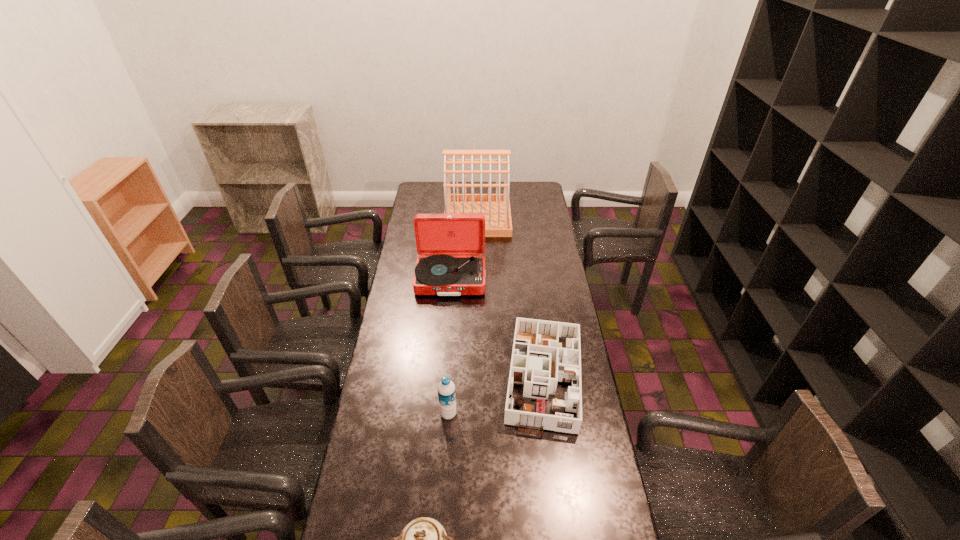
The width and height of the screenshot is (960, 540). I want to click on the tallest object, so click(495, 207).

Find the location of `birdcage`. birdcage is located at coordinates (495, 207).

Find the location of a particular element. The image size is (960, 540). the second farthest object is located at coordinates (451, 246).

Locate an element on the screen. phonograph_record is located at coordinates (451, 246).

Where is `water bottle`? Image resolution: width=960 pixels, height=540 pixels. water bottle is located at coordinates (446, 389).

The image size is (960, 540). Find the location of `dollhouse`. dollhouse is located at coordinates (538, 361).

Image resolution: width=960 pixels, height=540 pixels. I want to click on free point located with an open door on the birdcage, so click(x=547, y=218).

Identify the location of vacant space positioned on the front-facing side of the second farthest object. The image size is (960, 540). (447, 317).

Locate an element on the screen. Image resolution: width=960 pixels, height=540 pixels. vacant area located on the label of the third tallest object is located at coordinates (495, 414).

Where is `vacant position located on the left of the shortest object`? vacant position located on the left of the shortest object is located at coordinates (428, 374).